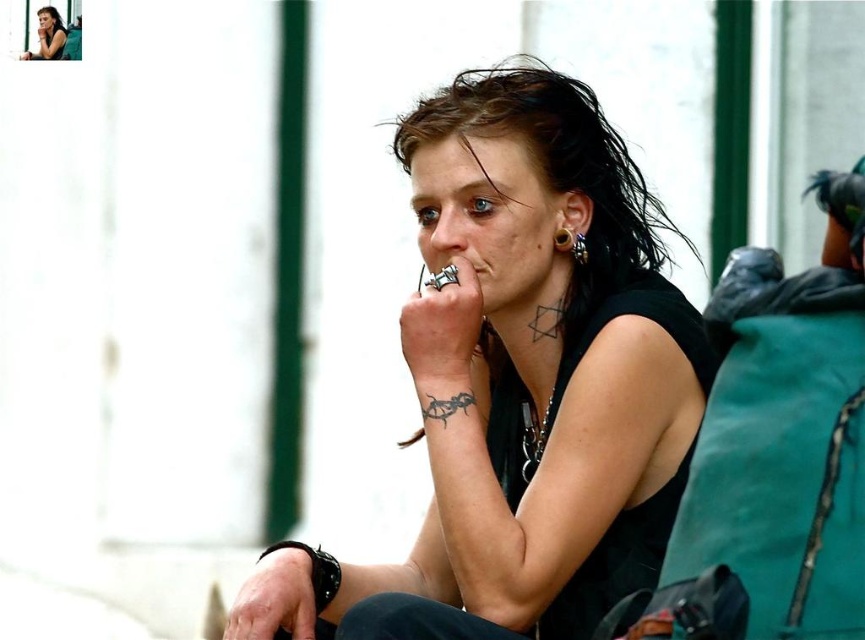
Question: Does matte black tank top at center appear on the left side of metallic ring at center?

Choices:
 (A) yes
 (B) no

Answer: (A)

Question: In this image, where is matte black tank top at center located relative to dark brown hair at upper left?

Choices:
 (A) below
 (B) above

Answer: (A)

Question: Which point is closer to the camera?

Choices:
 (A) (567, 236)
 (B) (466, 305)
 (C) (53, 20)

Answer: (B)

Question: Is leather wristwatch at lower left bigger than matte black tank top at center?

Choices:
 (A) no
 (B) yes

Answer: (A)

Question: Estimate the real-world distances between objects in this image. Which object is farther from the dark brown hair at upper left?

Choices:
 (A) matte black shirt at center
 (B) gold textured ring at ear

Answer: (A)

Question: Which object is farther from the camera taking this photo?

Choices:
 (A) matte black shirt at center
 (B) metallic ring at center
 (C) gold metallic ring at upper center
 (D) dark brown hair at upper left

Answer: (D)